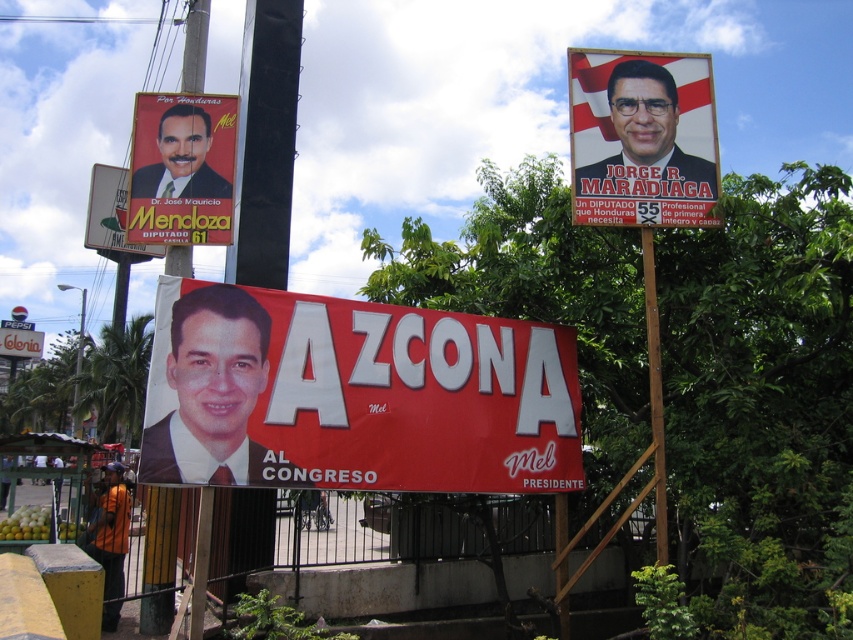
Question: Can you confirm if matte black poster at upper left is thinner than matte black banner at lower left?

Choices:
 (A) yes
 (B) no

Answer: (A)

Question: In this image, where is matte black signboard at upper left located relative to matte black banner at lower left?

Choices:
 (A) right
 (B) left

Answer: (A)

Question: From the image, what is the correct spatial relationship of matte red banner at center in relation to brown wooden pole at right?

Choices:
 (A) below
 (B) above

Answer: (B)

Question: Which of these objects is positioned closest to the orange fabric jacket at lower left?

Choices:
 (A) matte plastic poster at upper right
 (B) brown wooden pole at right
 (C) matte black poster at upper left
 (D) matte red banner at center

Answer: (C)

Question: Which object is the farthest from the brown wooden pole at right?

Choices:
 (A) matte plastic poster at upper right
 (B) matte black signboard at upper left
 (C) matte red banner at center

Answer: (B)

Question: Which object is closer to the camera taking this photo?

Choices:
 (A) orange fabric jacket at lower left
 (B) matte red banner at center
 (C) matte black signboard at upper left
 (D) matte plastic poster at upper right

Answer: (B)